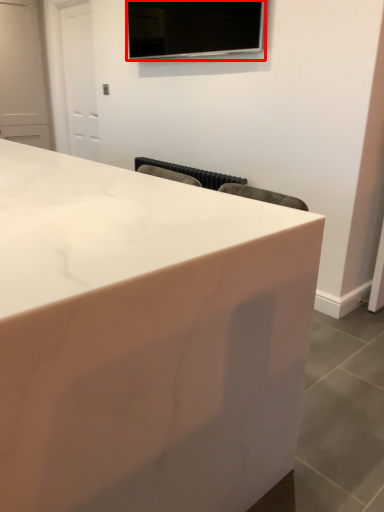
Question: Considering the relative positions of television (annotated by the red box) and countertop in the image provided, where is television (annotated by the red box) located with respect to the staircase?

Choices:
 (A) left
 (B) right

Answer: (B)